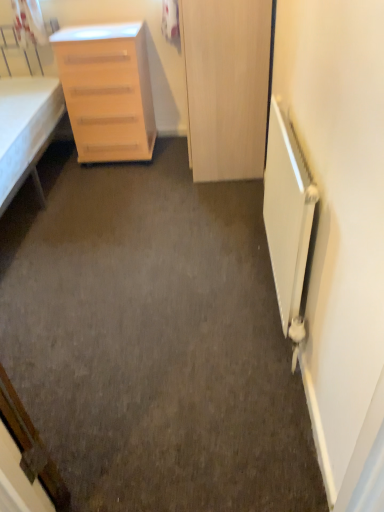
This screenshot has height=512, width=384. What are the coordinates of `free space in front of wooden door at center` in the screenshot? It's located at (197, 205).